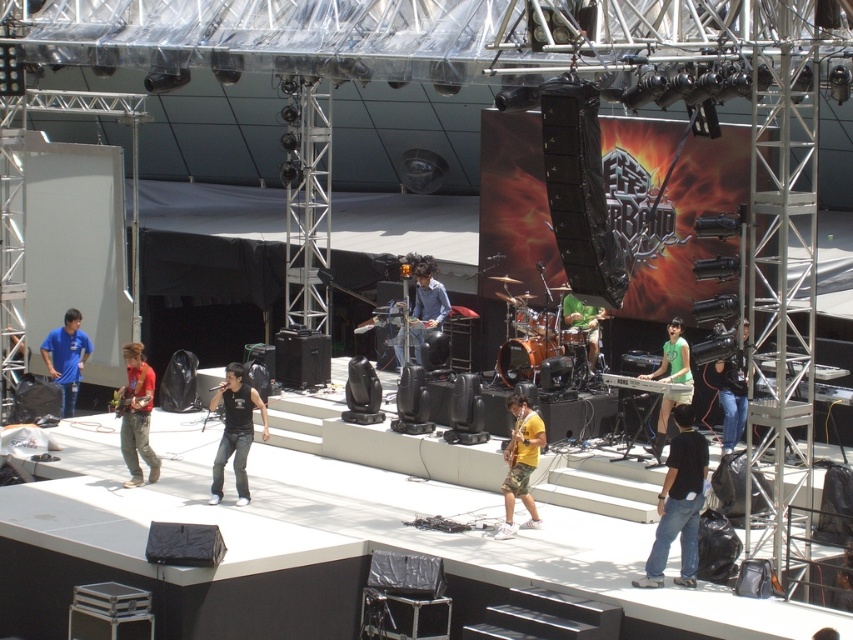
Where is `red cotton shirt at center`? red cotton shirt at center is located at coordinates (136, 416).

Who is shorter, red cotton shirt at center or matte blue shirt at center?

Standing shorter between the two is matte blue shirt at center.

Is point (137, 356) less distant than point (416, 269)?

That is True.

This screenshot has height=640, width=853. I want to click on red cotton shirt at center, so click(136, 416).

Find the location of a particular element. matte blue shirt at left is located at coordinates (67, 356).

Find the location of a particular element. This screenshot has width=853, height=640. matte blue shirt at left is located at coordinates [67, 356].

What do you see at coordinates (425, 305) in the screenshot? I see `matte blue shirt at center` at bounding box center [425, 305].

Who is more forward, (415, 273) or (677, 344)?

Point (677, 344) is more forward.

Where is `matte blue shirt at center`? matte blue shirt at center is located at coordinates (425, 305).

Identify the location of matte blue shirt at center. (425, 305).